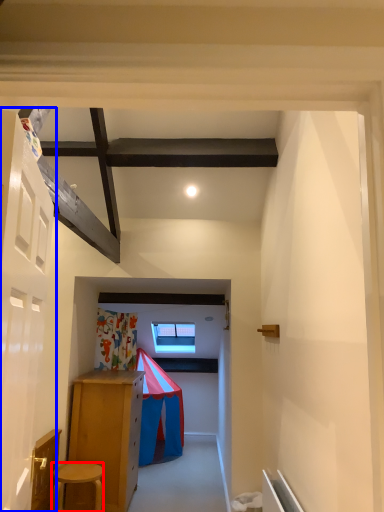
Question: Among these objects, which one is nearest to the camera, stool (highlighted by a red box) or door (highlighted by a blue box)?

Choices:
 (A) stool
 (B) door

Answer: (B)